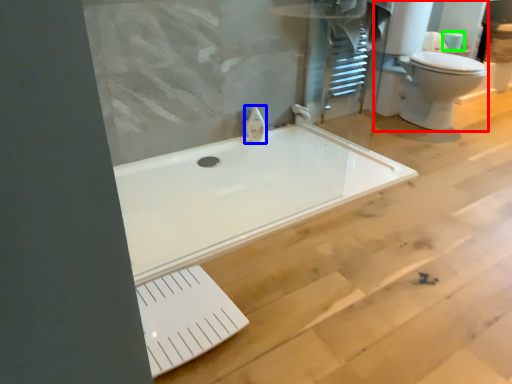
Question: Considering the real-world distances, which object is farthest from sink (highlighted by a red box)? faucet (highlighted by a blue box) or toilet paper (highlighted by a green box)?

Choices:
 (A) faucet
 (B) toilet paper

Answer: (A)